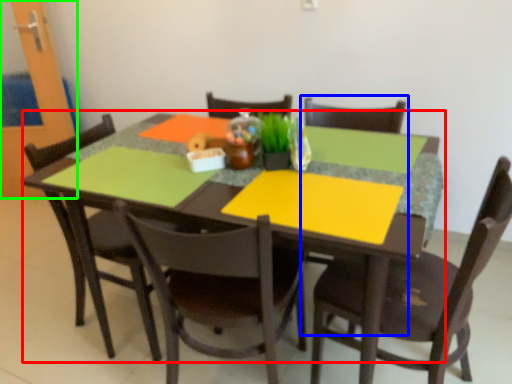
Question: Based on their relative distances, which object is nearer to kitchen & dining room table (highlighted by a red box)? Choose from armchair (highlighted by a blue box) and glass door (highlighted by a green box).

Choices:
 (A) armchair
 (B) glass door

Answer: (A)